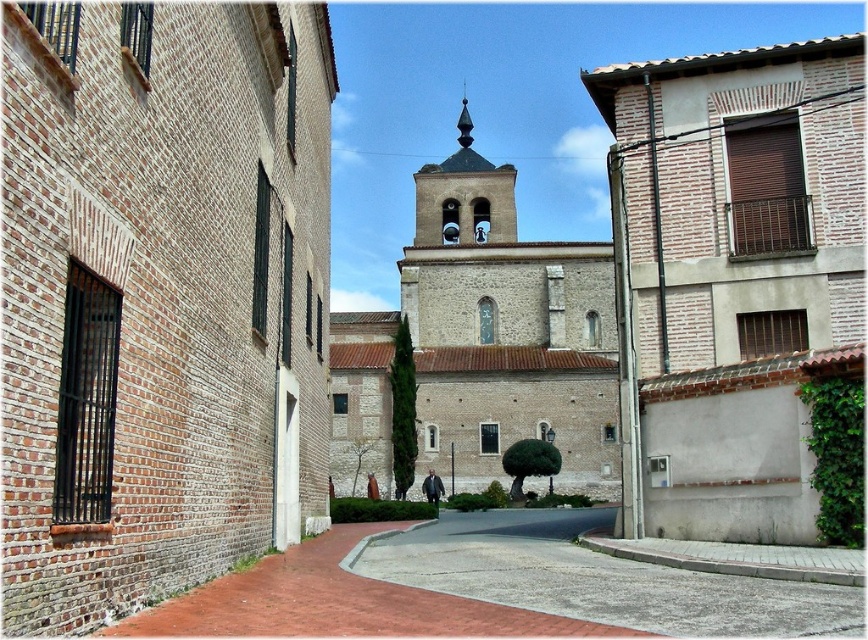
Who is positioned more to the right, white brick church at center or white stone church at center?

Positioned to the right is white brick church at center.

Is white brick church at center closer to the viewer compared to white stone church at center?

Yes, it is in front of white stone church at center.

Which is behind, point (702, 529) or point (531, 340)?

Point (531, 340)

What are the coordinates of `white brick church at center` in the screenshot? It's located at [730, 275].

Is the position of brown brick church at center less distant than that of white brick church at center?

Yes, brown brick church at center is closer to the viewer.

How distant is brown brick church at center from white brick church at center?

The distance of brown brick church at center from white brick church at center is 15.67 meters.

The height and width of the screenshot is (640, 868). Describe the element at coordinates (160, 296) in the screenshot. I see `brown brick church at center` at that location.

This screenshot has width=868, height=640. I want to click on brown brick church at center, so click(x=160, y=296).

Who is shorter, brown brick church at center or gray stone bell tower at center?

brown brick church at center

Is brown brick church at center to the right of gray stone bell tower at center from the viewer's perspective?

No, brown brick church at center is not to the right of gray stone bell tower at center.

The image size is (868, 640). Describe the element at coordinates (160, 296) in the screenshot. I see `brown brick church at center` at that location.

You are a GUI agent. You are given a task and a screenshot of the screen. Output one action in this format:
    pyautogui.click(x=<x>, y=<y>)
    Task: Click on the brown brick church at center
    
    Given the screenshot: What is the action you would take?
    pyautogui.click(x=160, y=296)